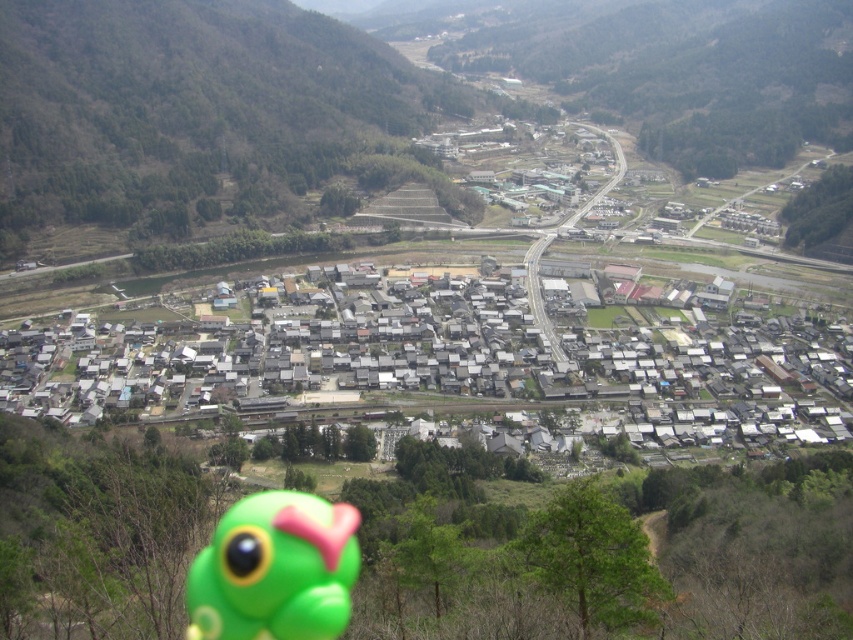
Who is higher up, gray/flat-roofed houses at center or green rubber toy at lower left?

gray/flat-roofed houses at center is higher up.

Who is more distant from viewer, (235, 388) or (345, 529)?

Positioned behind is point (235, 388).

Between point (660, 420) and point (289, 620), which one is positioned in front?

Point (289, 620) is in front.

At what (x,y) coordinates should I click in order to perform the action: click on gray/flat-roofed houses at center. Please return your answer as a coordinate pair (x, y). This screenshot has width=853, height=640. Looking at the image, I should click on (462, 360).